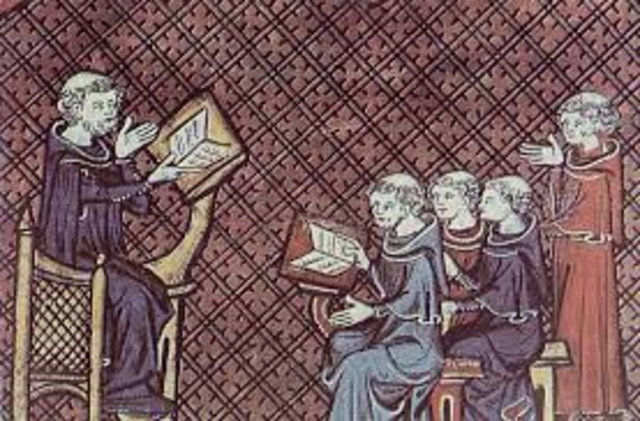
Identify the location of wall. (404, 143).